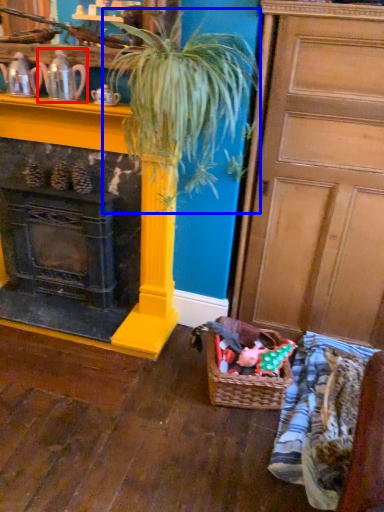
Question: Which of the following is the closest to the observer, tea pot (highlighted by a red box) or houseplant (highlighted by a blue box)?

Choices:
 (A) tea pot
 (B) houseplant

Answer: (B)